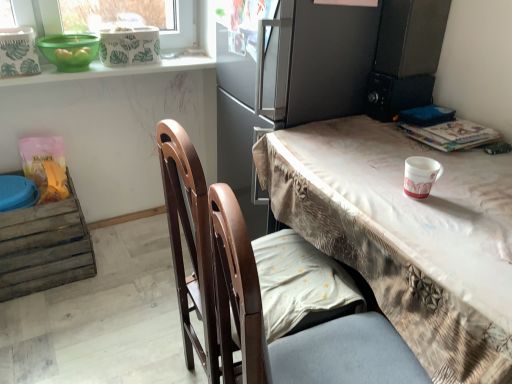
Find the location of a particular element. free location in front of weathered wood crate at lower left is located at coordinates (42, 319).